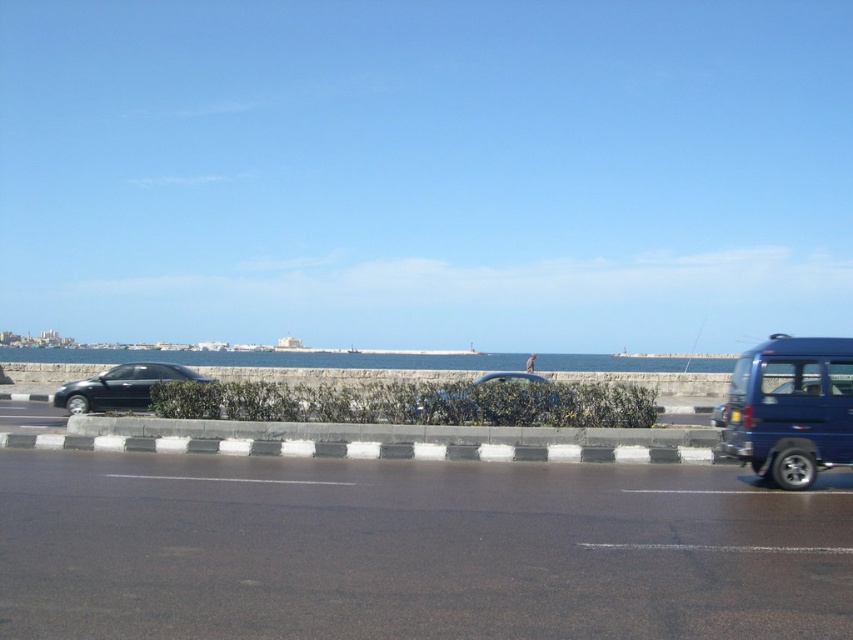
Based on the photo, which is more to the right, metallic blue van at right or black plastic license plate at right?

metallic blue van at right is more to the right.

In the scene shown: Can you confirm if metallic blue van at right is smaller than black plastic license plate at right?

Actually, metallic blue van at right might be larger than black plastic license plate at right.

Which is in front, point (793, 337) or point (740, 420)?

Positioned in front is point (740, 420).

I want to click on metallic blue van at right, so click(791, 408).

Who is positioned more to the right, black asphalt highway at center or blue water at center?

black asphalt highway at center is more to the right.

This screenshot has height=640, width=853. What are the coordinates of `black asphalt highway at center` in the screenshot? It's located at (413, 550).

Who is lower down, metallic blue van at right or blue water at center?

blue water at center

Does metallic blue van at right have a greater height compared to blue water at center?

No, metallic blue van at right is not taller than blue water at center.

Locate an element on the screen. The height and width of the screenshot is (640, 853). metallic blue van at right is located at coordinates (791, 408).